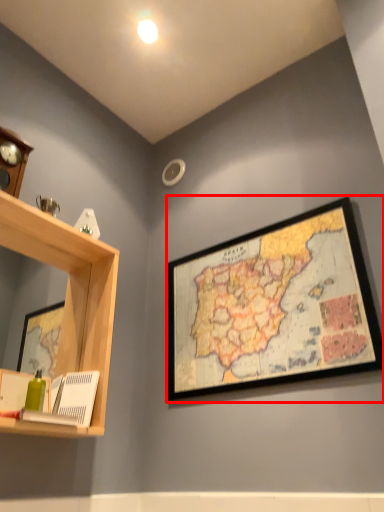
Question: From the image, what is the correct spatial relationship of picture frame (annotated by the red box) in relation to shelf?

Choices:
 (A) right
 (B) left

Answer: (A)